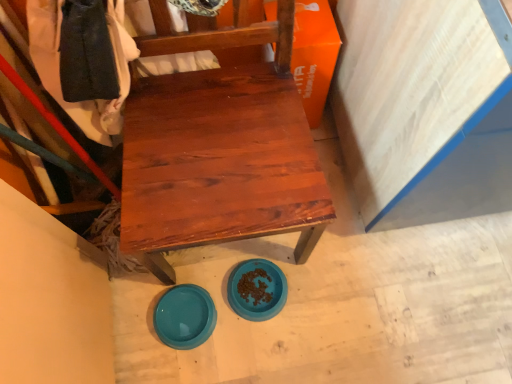
At what (x,y) coordinates should I click in order to perform the action: click on vacant space that is to the left of blue plastic bowl at lower center, marked as the 2th plate in a left-to-right arrangement. Please return your answer as a coordinate pair (x, y). Looking at the image, I should click on (200, 279).